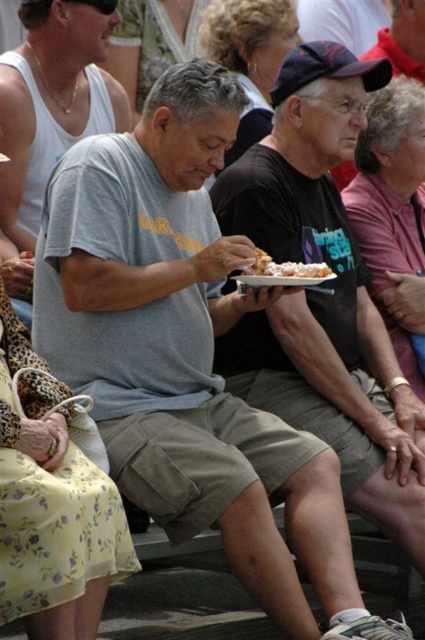
Question: In this image, where is floral fabric dress at lower left located relative to frosted pastry at center?

Choices:
 (A) right
 (B) left

Answer: (B)

Question: Which object is farther from the camera taking this photo?

Choices:
 (A) gray cotton shirt at center
 (B) floral fabric dress at lower left

Answer: (A)

Question: Among these objects, which one is farthest from the camera?

Choices:
 (A) blonde hair at upper center
 (B) floral fabric dress at lower left
 (C) gray cotton shirt at center
 (D) curly blonde hair at upper center

Answer: (A)

Question: Considering the relative positions of floral fabric dress at lower left and gray cotton shirt at center in the image provided, where is floral fabric dress at lower left located with respect to gray cotton shirt at center?

Choices:
 (A) above
 (B) below

Answer: (B)

Question: Which of the following is the farthest from the observer?

Choices:
 (A) curly blonde hair at upper center
 (B) frosted pastry at center

Answer: (A)

Question: Does floral fabric dress at lower left have a smaller size compared to frosted pastry at center?

Choices:
 (A) yes
 (B) no

Answer: (A)